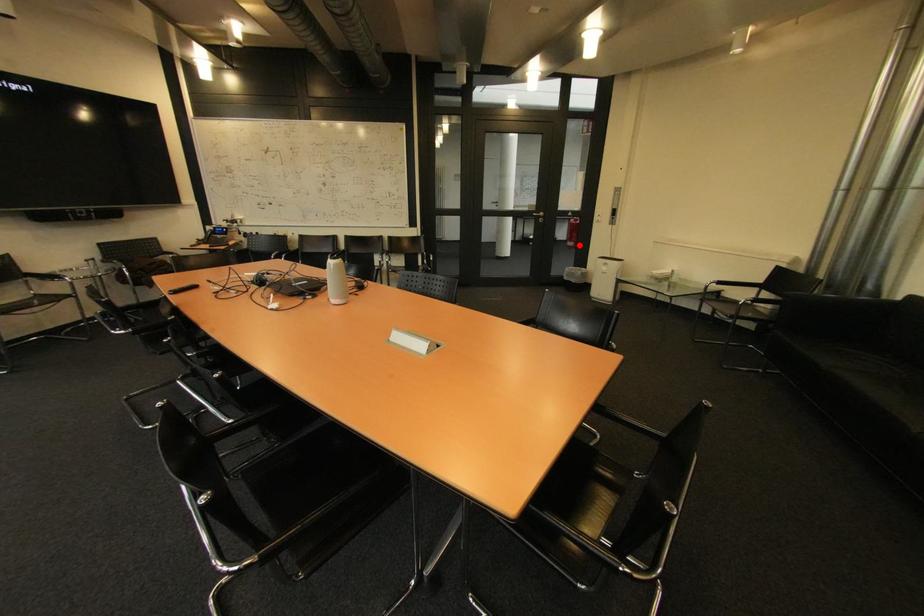
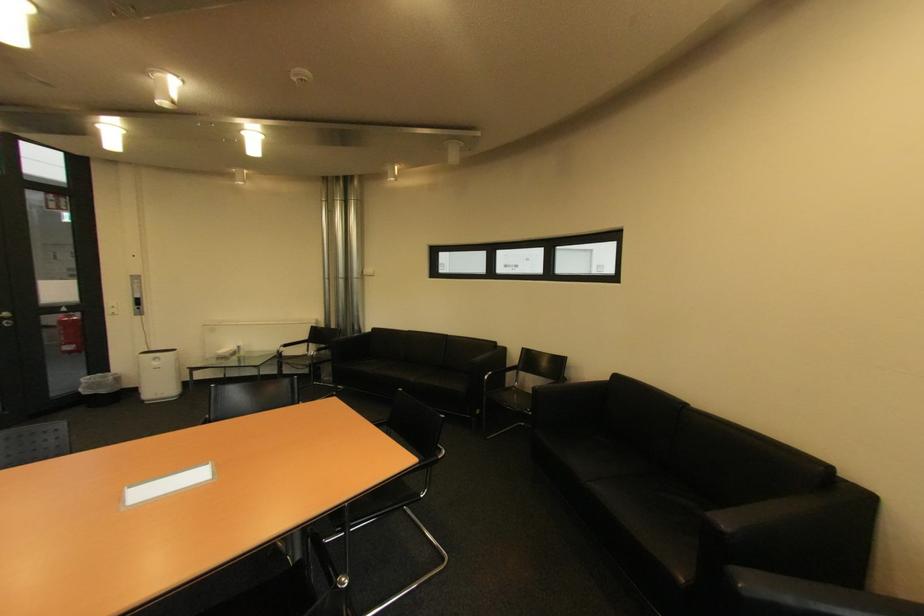
Question: I am providing you with two images of the same scene from different viewpoints. Given a red point in image1, look at the same physical point in image2. Is it:

Choices:
 (A) Closer to the viewpoint
 (B) Farther from the viewpoint

Answer: (A)